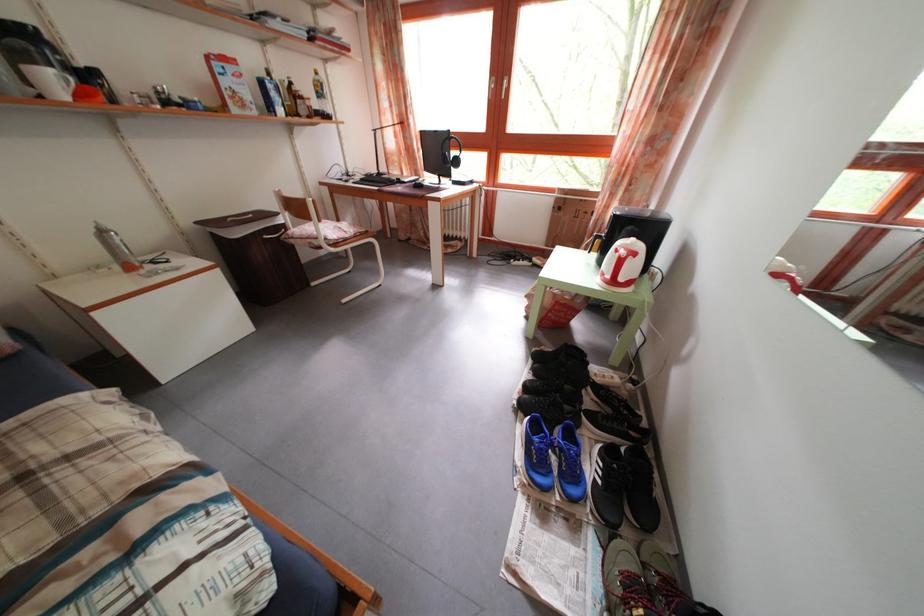
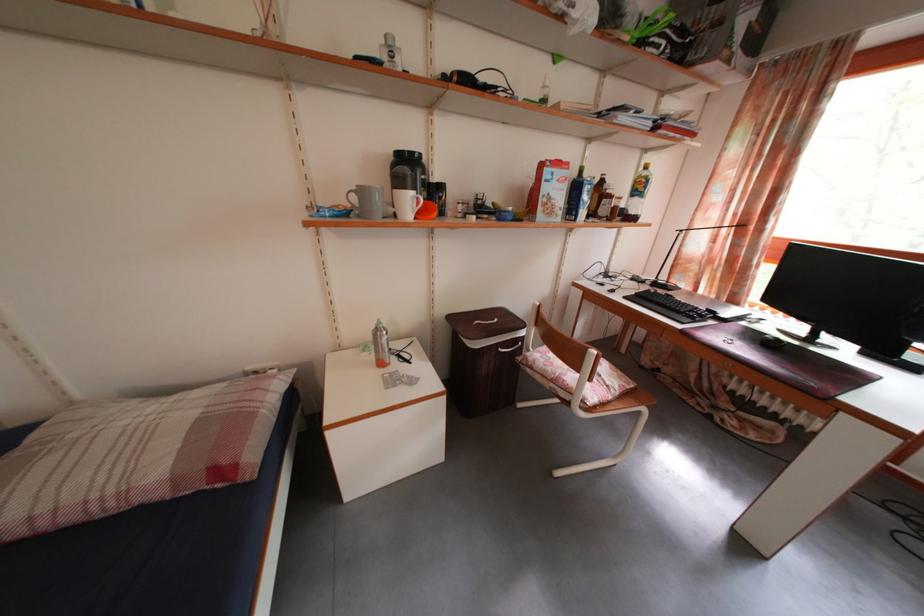
Locate, in the second image, the point that corresponds to (x=391, y=177) in the first image.

(671, 285)